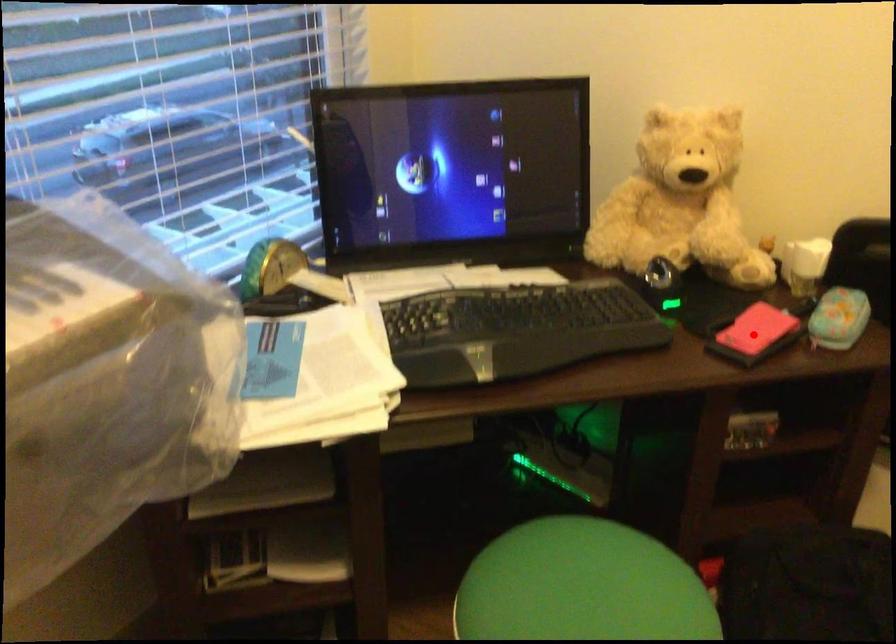
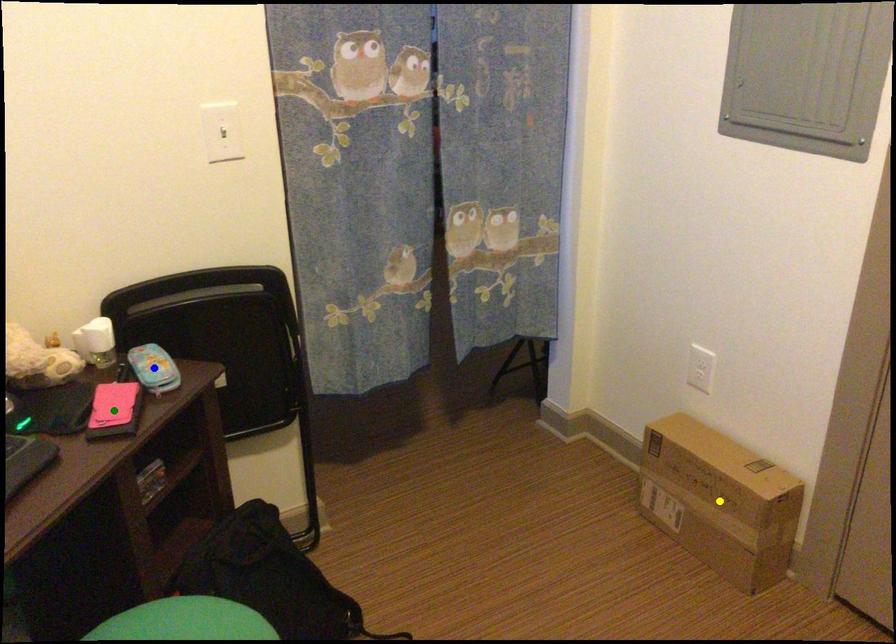
Question: I am providing you with two images of the same scene from different viewpoints. A red point is marked on the first image. You are given multiple points on the second image. In image 2, which mark is for the same physical point as the one in image 1?

Choices:
 (A) blue point
 (B) green point
 (C) yellow point

Answer: (B)